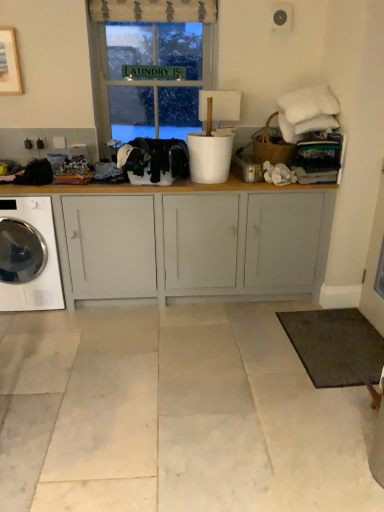
Question: From the image's perspective, is black fabric at center, the second clothing from the left, beneath white glossy washing machine at lower left?

Choices:
 (A) no
 (B) yes

Answer: (A)

Question: Are black fabric at center, the second clothing from the left, and white glossy washing machine at lower left beside each other?

Choices:
 (A) yes
 (B) no

Answer: (B)

Question: Does black fabric at center, the first clothing in the right-to-left sequence, lie behind white glossy washing machine at lower left?

Choices:
 (A) no
 (B) yes

Answer: (A)

Question: From the image's perspective, does black fabric at center, the first clothing in the right-to-left sequence, appear higher than white glossy washing machine at lower left?

Choices:
 (A) no
 (B) yes

Answer: (B)

Question: Considering the relative positions of black fabric at center, the second clothing from the left, and white glossy washing machine at lower left in the image provided, is black fabric at center, the second clothing from the left, in front of white glossy washing machine at lower left?

Choices:
 (A) yes
 (B) no

Answer: (A)

Question: In terms of height, does matte gray cabinet at center look taller or shorter compared to white glossy washing machine at lower left?

Choices:
 (A) short
 (B) tall

Answer: (B)

Question: From a real-world perspective, relative to white glossy washing machine at lower left, is matte gray cabinet at center vertically above or below?

Choices:
 (A) above
 (B) below

Answer: (A)

Question: Considering the positions of matte gray cabinet at center and white glossy washing machine at lower left in the image, is matte gray cabinet at center bigger or smaller than white glossy washing machine at lower left?

Choices:
 (A) big
 (B) small

Answer: (A)

Question: Would you say matte gray cabinet at center is inside or outside white glossy washing machine at lower left?

Choices:
 (A) inside
 (B) outside

Answer: (B)

Question: Do you think black fabric at left, arranged as the first clothing when viewed from the left, is within matte gray cabinet at center, or outside of it?

Choices:
 (A) outside
 (B) inside

Answer: (A)

Question: Considering the positions of black fabric at left, arranged as the first clothing when viewed from the left, and matte gray cabinet at center in the image, is black fabric at left, arranged as the first clothing when viewed from the left, bigger or smaller than matte gray cabinet at center?

Choices:
 (A) big
 (B) small

Answer: (B)

Question: Is black fabric at left, arranged as the first clothing when viewed from the left, taller or shorter than matte gray cabinet at center?

Choices:
 (A) tall
 (B) short

Answer: (B)

Question: Does point (28, 173) appear closer or farther from the camera than point (226, 273)?

Choices:
 (A) closer
 (B) farther

Answer: (A)

Question: From their relative heights in the image, would you say matte gray cabinet at center is taller or shorter than metallic silver canister at center?

Choices:
 (A) tall
 (B) short

Answer: (A)

Question: Do you think matte gray cabinet at center is within metallic silver canister at center, or outside of it?

Choices:
 (A) inside
 (B) outside

Answer: (B)